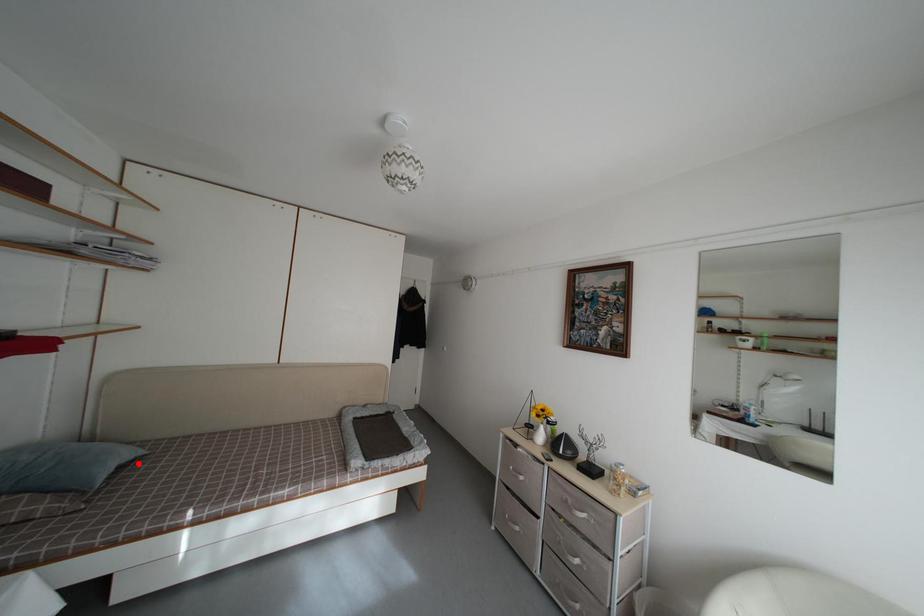
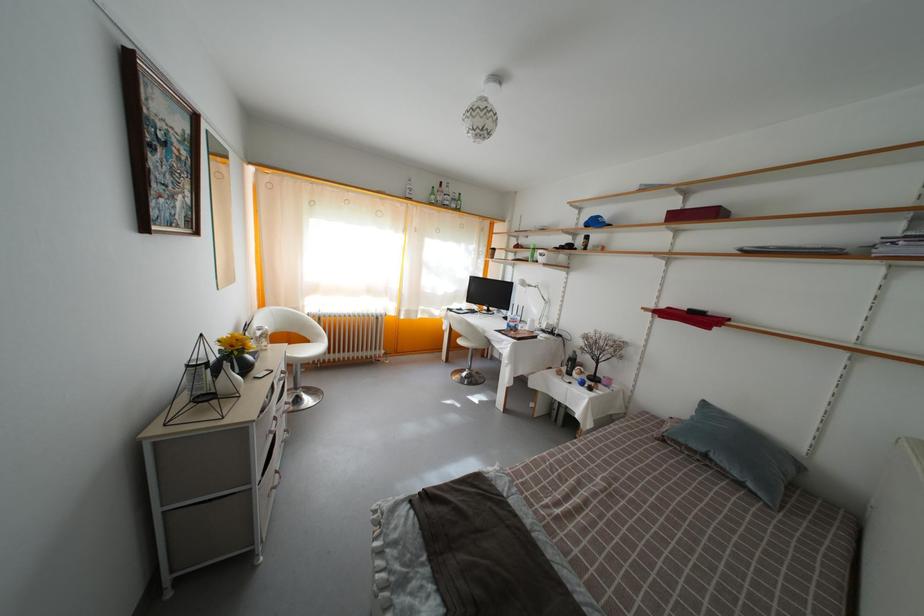
Find the pixel in the second image that matches the highlighted location in the first image.

(743, 482)